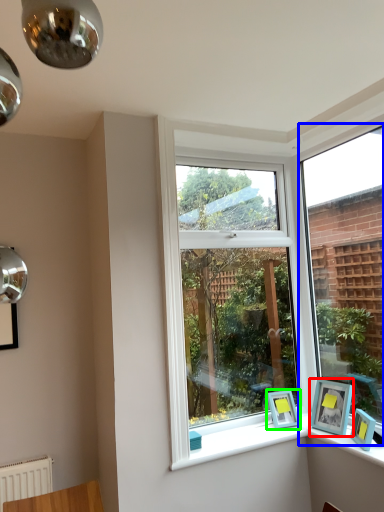
Question: Which object is the farthest from picture frame (highlighted by a red box)? Choose among these: window (highlighted by a blue box) or picture frame (highlighted by a green box).

Choices:
 (A) window
 (B) picture frame

Answer: (A)